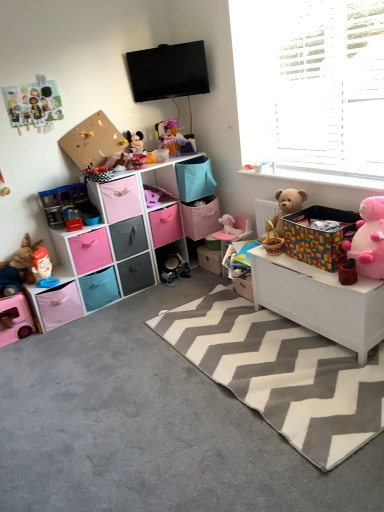
This screenshot has width=384, height=512. Find the location of `vacant space underneath white wooden blinds at upper right (from a real-world perspective)`. vacant space underneath white wooden blinds at upper right (from a real-world perspective) is located at coordinates (313, 173).